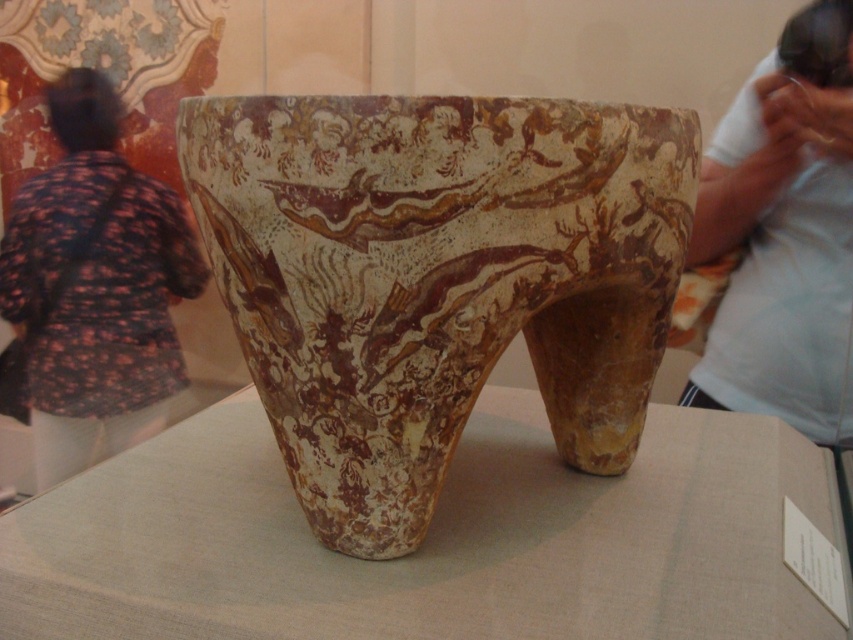
Looking at this image, does brown textured vase at center appear under floral-patterned shirt at left?

Indeed, brown textured vase at center is positioned under floral-patterned shirt at left.

Can you confirm if brown textured vase at center is smaller than floral-patterned shirt at left?

Yes.

Image resolution: width=853 pixels, height=640 pixels. I want to click on brown textured vase at center, so click(x=436, y=278).

Is brown textured vase at center to the left of white cotton shirt at upper right from the viewer's perspective?

Indeed, brown textured vase at center is positioned on the left side of white cotton shirt at upper right.

What are the coordinates of `brown textured vase at center` in the screenshot? It's located at (436, 278).

Is point (67, 129) less distant than point (842, 1)?

No.

Based on the photo, does floral-patterned shirt at left appear on the right side of white cotton shirt at upper right?

In fact, floral-patterned shirt at left is to the left of white cotton shirt at upper right.

Is point (183, 244) positioned before point (703, 387)?

That is False.

You are a GUI agent. You are given a task and a screenshot of the screen. Output one action in this format:
    pyautogui.click(x=<x>, y=<y>)
    Task: Click on the floral-patterned shirt at left
    
    Given the screenshot: What is the action you would take?
    pyautogui.click(x=96, y=288)